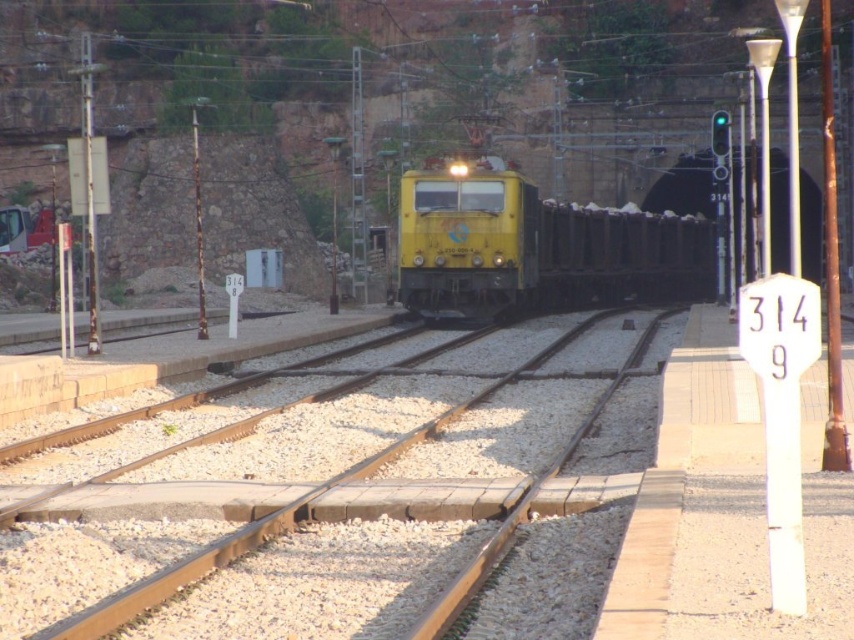
Question: Is yellow matte train at center to the left of brown metal train track at center from the viewer's perspective?

Choices:
 (A) yes
 (B) no

Answer: (B)

Question: Does yellow matte train at center come behind brown metal train track at center?

Choices:
 (A) yes
 (B) no

Answer: (A)

Question: Does yellow matte train at center appear on the right side of brown metal train track at center?

Choices:
 (A) yes
 (B) no

Answer: (A)

Question: Among these points, which one is nearest to the camera?

Choices:
 (A) (424, 220)
 (B) (381, 458)

Answer: (B)

Question: Which point is closer to the camera?

Choices:
 (A) (162, 572)
 (B) (521, 298)

Answer: (A)